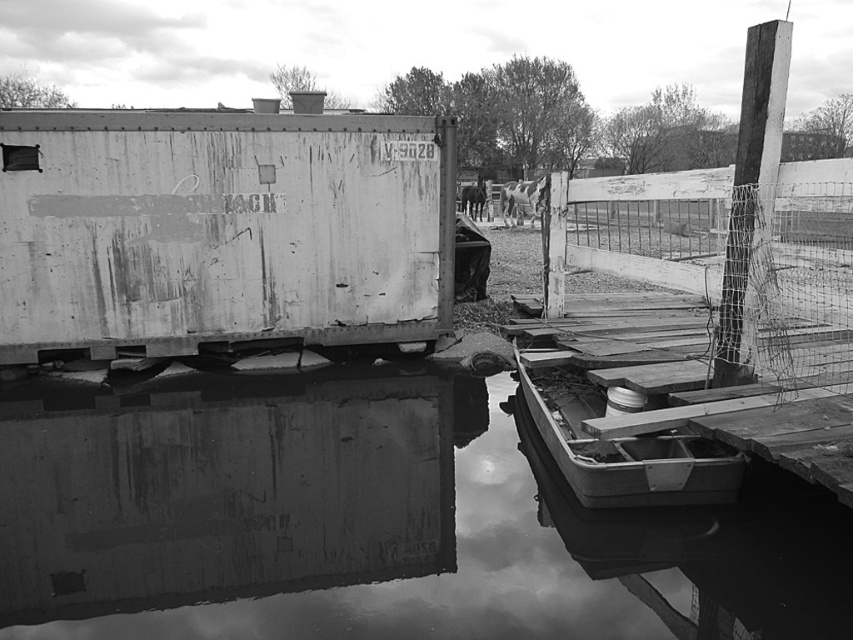
Question: Which point is farther to the camera?

Choices:
 (A) (712, 369)
 (B) (297, 380)
 (C) (717, 496)

Answer: (B)

Question: Where is rusty wire mesh fence at right located in relation to wooden boat at lower right in the image?

Choices:
 (A) above
 (B) below

Answer: (A)

Question: Is the position of reflective water at lower center more distant than that of rusty wire mesh fence at right?

Choices:
 (A) no
 (B) yes

Answer: (A)

Question: Which point is farther to the camera?

Choices:
 (A) rusty wire mesh fence at right
 (B) reflective water at lower center
 (C) wooden boat at lower right

Answer: (A)

Question: Considering the real-world distances, which object is farthest from the rusty metal container at left?

Choices:
 (A) rusty wire mesh fence at right
 (B) wooden boat at lower right
 (C) reflective water at lower center

Answer: (A)

Question: Is rusty metal container at left positioned before rusty wire mesh fence at right?

Choices:
 (A) no
 (B) yes

Answer: (A)